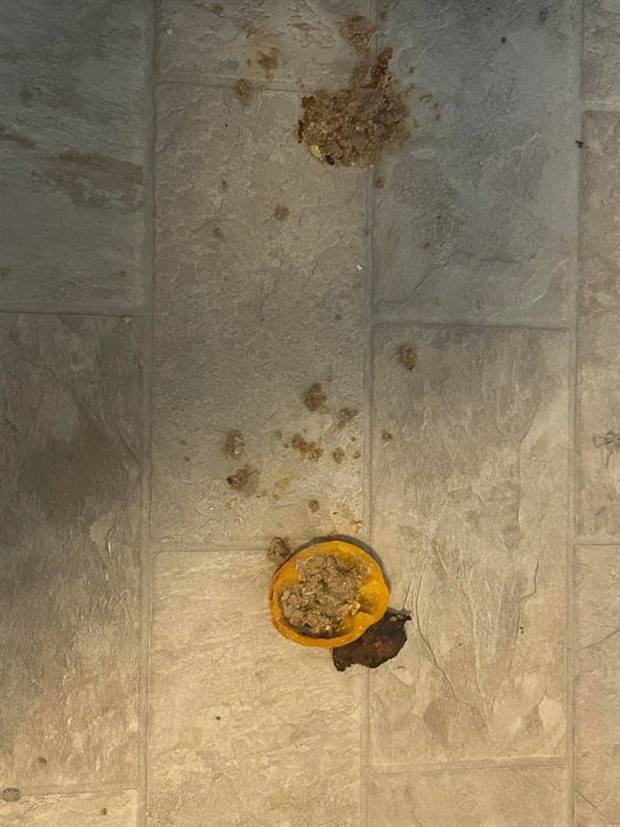
Locate an element on the screen. The height and width of the screenshot is (827, 620). tile is located at coordinates (201, 768).